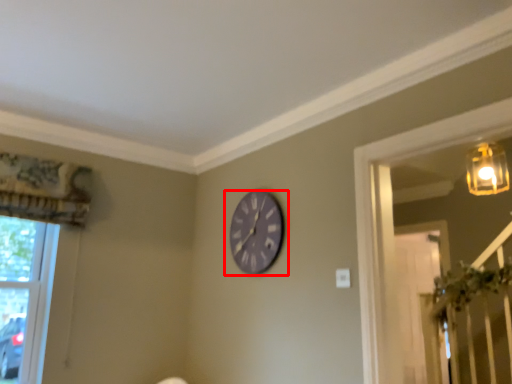
Question: From the image, what is the correct spatial relationship of wall clock (annotated by the red box) in relation to window?

Choices:
 (A) right
 (B) left

Answer: (A)